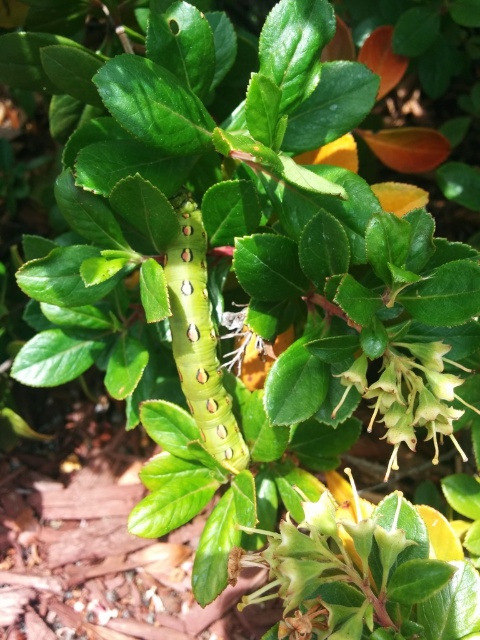
Question: Can you confirm if green matte caterpillar at center is positioned above white matte flower at center?

Choices:
 (A) no
 (B) yes

Answer: (B)

Question: Which object is farther from the camera taking this photo?

Choices:
 (A) green matte caterpillar at center
 (B) white matte flower at center

Answer: (A)

Question: Observing the image, what is the correct spatial positioning of green matte caterpillar at center in reference to white matte flower at center?

Choices:
 (A) left
 (B) right

Answer: (A)

Question: Does green matte caterpillar at center appear on the right side of white matte flower at center?

Choices:
 (A) yes
 (B) no

Answer: (B)

Question: Which point is farther to the camera?

Choices:
 (A) green matte caterpillar at center
 (B) white matte flower at center

Answer: (A)